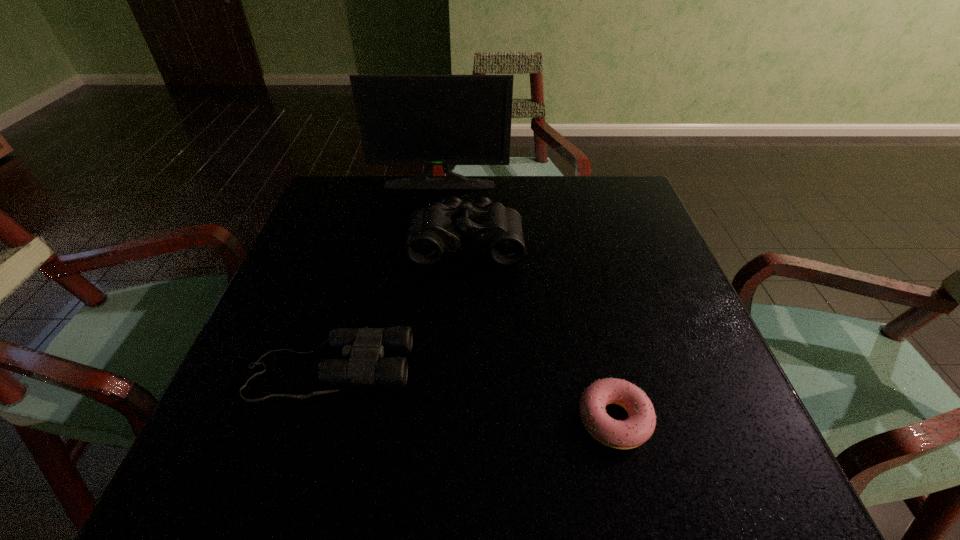
Identify the location of vacant space located 0.260m at the eyepiece of the second shortest object. The height and width of the screenshot is (540, 960). (557, 369).

The width and height of the screenshot is (960, 540). I want to click on vacant region located on the left of the doughnut, so click(x=348, y=420).

At what (x,y) coordinates should I click in order to perform the action: click on monitor located at the far edge. Please return your answer as a coordinate pair (x, y). This screenshot has width=960, height=540. Looking at the image, I should click on (430, 120).

The width and height of the screenshot is (960, 540). Identify the location of binoculars located in the far edge section of the desktop. (494, 229).

Image resolution: width=960 pixels, height=540 pixels. In order to click on object at the near edge in this screenshot , I will do `click(639, 426)`.

Identify the location of monitor present at the left edge. Image resolution: width=960 pixels, height=540 pixels. (430, 120).

Identify the location of binoculars that is at the left edge. The width and height of the screenshot is (960, 540). 363,348.

The height and width of the screenshot is (540, 960). I want to click on object that is at the right edge, so click(639, 426).

The width and height of the screenshot is (960, 540). Identify the location of object positioned at the far left corner. (430, 120).

The image size is (960, 540). In order to click on object present at the near right corner in this screenshot , I will do `click(639, 426)`.